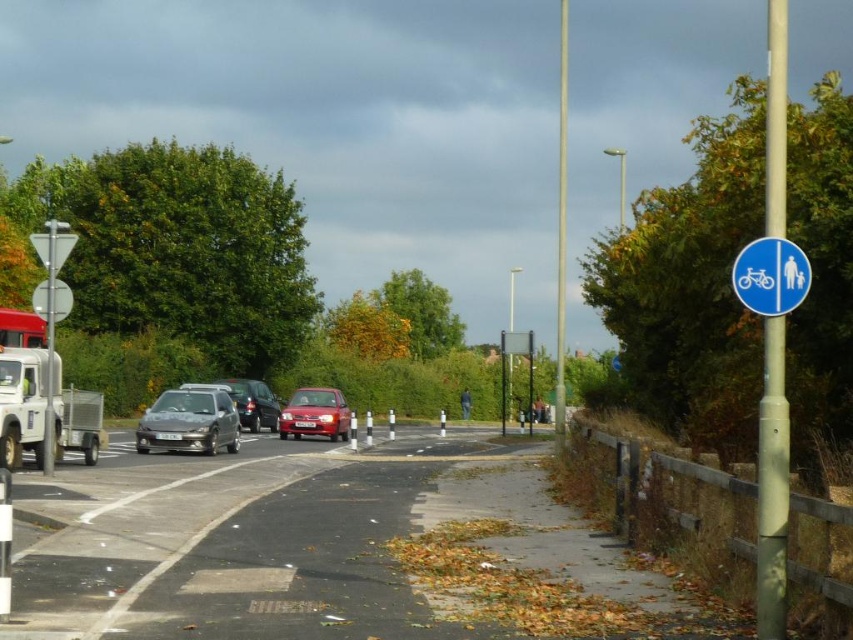
You are driving a car and see the blue plastic sign at upper right and the metallic silver car at center. Which object is larger in the image?

The blue plastic sign at upper right is bigger than the metallic silver car at center.

You are a pedestrian standing at the pedestrian crossing area near the road. You see a blue plastic sign at upper right and a metallic silver car at center. Which object is farther away from you?

The blue plastic sign at upper right is 123.04 feet away from the metallic silver car at center, so the blue plastic sign at upper right is farther away from you than the metallic silver car at center.